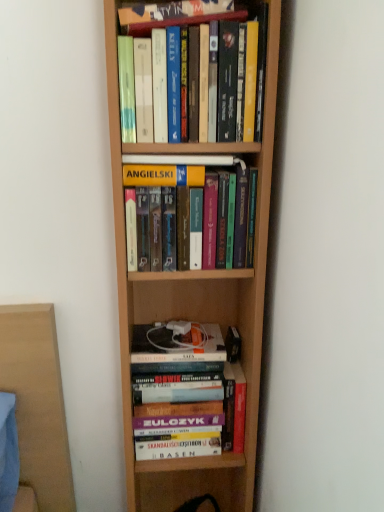
Question: Is wooden bookshelf at lower center taller or shorter than hardcover books at center, which ranks as the 4th book in top-to-bottom order?

Choices:
 (A) short
 (B) tall

Answer: (A)

Question: From the image's perspective, is wooden bookshelf at lower center located above or below hardcover books at center, which ranks as the 4th book in top-to-bottom order?

Choices:
 (A) below
 (B) above

Answer: (A)

Question: Estimate the real-world distances between objects in this image. Which object is farther from the hardcover books at center, which ranks as the 4th book in top-to-bottom order?

Choices:
 (A) hardcover book at upper center, which is the fourth book in bottom-to-top order
 (B) hardcover books at upper center, the 2th book viewed from the top
 (C) wooden bookshelf at lower center
 (D) hardcover books at center, which is the third book from top to bottom

Answer: (A)

Question: Considering the real-world distances, which object is closest to the hardcover books at upper center, the 2th book viewed from the top?

Choices:
 (A) hardcover book at upper center, which is the fourth book in bottom-to-top order
 (B) hardcover books at center, marked as the second book in a bottom-to-top arrangement
 (C) wooden bookshelf at lower center
 (D) hardcover books at center, the 1th book when ordered from bottom to top

Answer: (A)